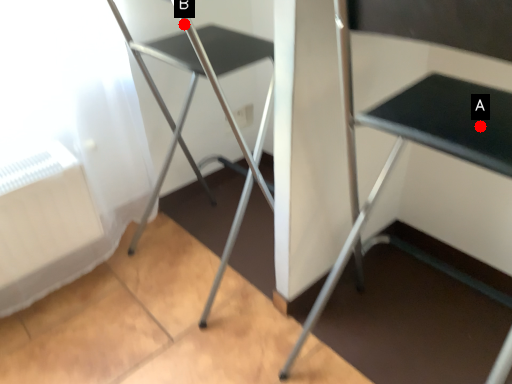
Question: Two points are circled on the image, labeled by A and B beside each circle. Which of the following is the closest to the observer?

Choices:
 (A) A is closer
 (B) B is closer

Answer: (A)